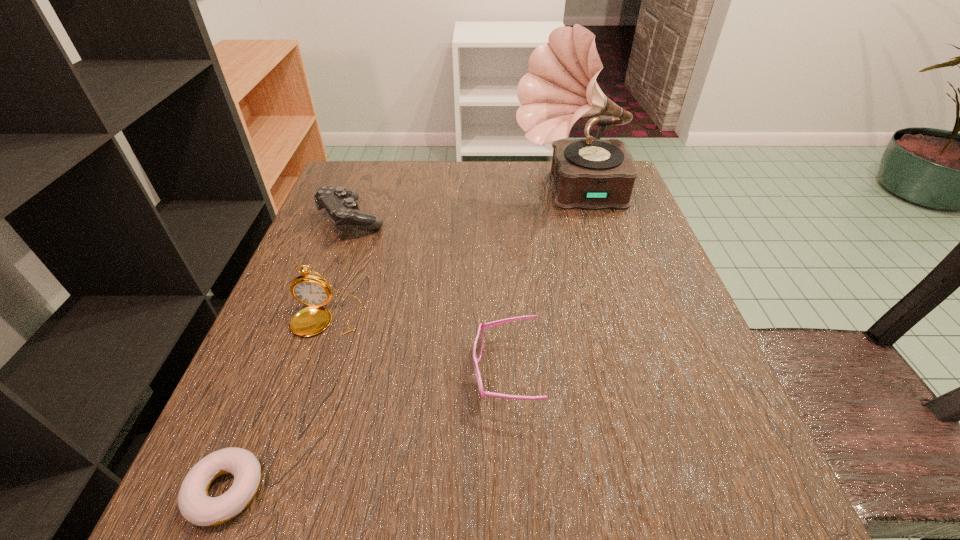
Image resolution: width=960 pixels, height=540 pixels. What are the coordinates of `blank region between the nearest object and the pocket watch` in the screenshot? It's located at (276, 404).

Where is `free space between the fourth tallest object and the record player`? free space between the fourth tallest object and the record player is located at coordinates (538, 283).

Where is `free space between the tallest object and the pocket watch`? free space between the tallest object and the pocket watch is located at coordinates (448, 255).

This screenshot has height=540, width=960. I want to click on free spot between the third tallest object and the fourth shortest object, so click(339, 268).

The width and height of the screenshot is (960, 540). What are the coordinates of `free area in between the second tallest object and the third shortest object` in the screenshot? It's located at (339, 268).

You are a GUI agent. You are given a task and a screenshot of the screen. Output one action in this format:
    pyautogui.click(x=<x>, y=<y>)
    Task: Click on the vacant space in between the sunglasses and the record player
    This screenshot has height=540, width=960.
    Given the screenshot: What is the action you would take?
    [x=538, y=283]

Where is `free space that is in between the control and the tallest object`? free space that is in between the control and the tallest object is located at coordinates 461,206.

Image resolution: width=960 pixels, height=540 pixels. Find the location of `empty space that is in between the pocket watch and the fourth tallest object`. empty space that is in between the pocket watch and the fourth tallest object is located at coordinates click(x=416, y=346).

You are a GUI agent. You are given a task and a screenshot of the screen. Output one action in this format:
    pyautogui.click(x=<x>, y=<y>)
    Task: Click on the unoccupied position between the sunglasses and the shortest object
    This screenshot has height=540, width=960.
    Given the screenshot: What is the action you would take?
    pyautogui.click(x=366, y=431)

Identify the location of blank region between the sunglasses and the pocket watch. The image size is (960, 540). pyautogui.click(x=416, y=346).